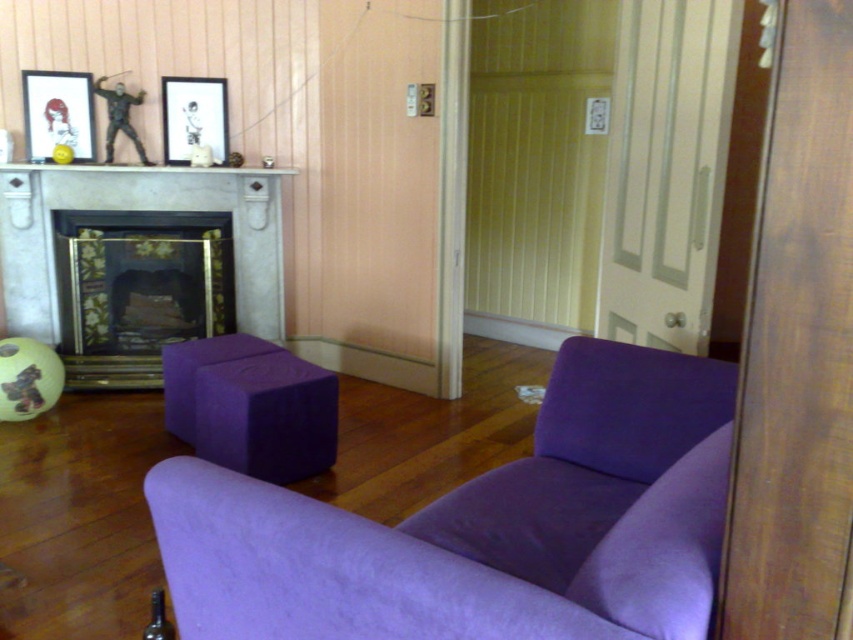
Who is shorter, matte black picture frame at upper left or matte black picture frame at upper center?

Standing shorter between the two is matte black picture frame at upper left.

Between matte black picture frame at upper left and matte black picture frame at upper center, which one appears on the left side from the viewer's perspective?

Positioned to the left is matte black picture frame at upper left.

Locate an element on the screen. This screenshot has height=640, width=853. matte black picture frame at upper left is located at coordinates (57, 113).

Who is lower down, matte gray fireplace at left or matte black picture frame at upper left?

matte gray fireplace at left

Can you confirm if matte gray fireplace at left is bigger than matte black picture frame at upper left?

Correct, matte gray fireplace at left is larger in size than matte black picture frame at upper left.

Where is `matte gray fireplace at left`? matte gray fireplace at left is located at coordinates (137, 260).

What do you see at coordinates (251, 406) in the screenshot? The height and width of the screenshot is (640, 853). I see `purple foam block at lower center` at bounding box center [251, 406].

Between point (335, 452) and point (186, 124), which one is positioned behind?

The point (186, 124) is more distant.

Find the location of a particular element. purple foam block at lower center is located at coordinates (251, 406).